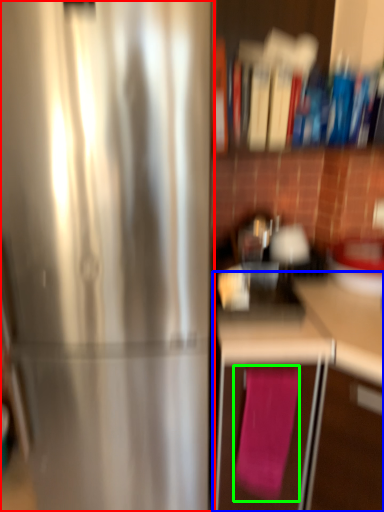
Question: Estimate the real-world distances between objects in this image. Which object is farther from refrigerator (highlighted by a red box), cabinetry (highlighted by a blue box) or bath towel (highlighted by a green box)?

Choices:
 (A) cabinetry
 (B) bath towel

Answer: (B)